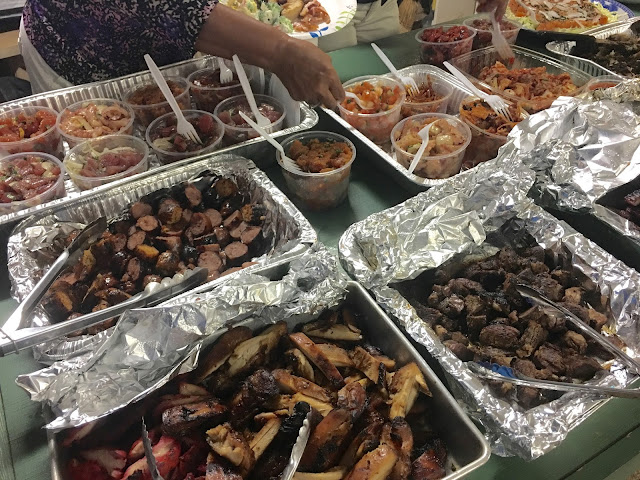
Image resolution: width=640 pixels, height=480 pixels. I want to click on fork, so click(x=177, y=118).